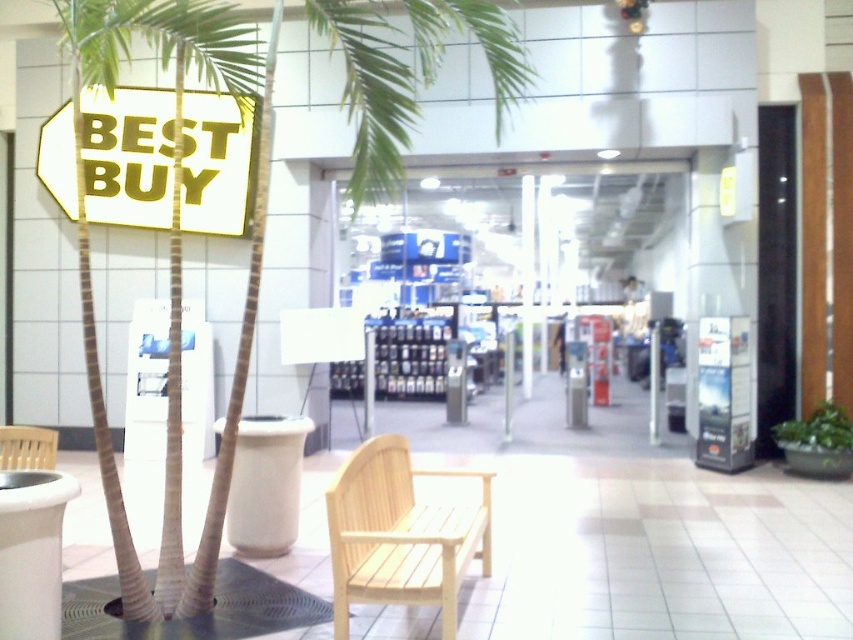
Question: Does light wood bench at lower center appear over wooden bench at lower left?

Choices:
 (A) yes
 (B) no

Answer: (B)

Question: Can you confirm if matte plastic shelves at center is wider than metallic pole at center?

Choices:
 (A) yes
 (B) no

Answer: (A)

Question: Which is nearer to the metallic pole at center?

Choices:
 (A) wooden bench at lower left
 (B) white matte sign at upper left
 (C) light wood bench at lower center

Answer: (B)

Question: Which point is farther to the camera?

Choices:
 (A) light wood bench at lower center
 (B) metallic pole at center
 (C) wooden bench at lower left
 (D) white matte sign at upper left

Answer: (B)

Question: Which point appears closest to the camera in this image?

Choices:
 (A) (380, 456)
 (B) (50, 452)

Answer: (A)

Question: Is matte plastic shelves at center below light wood bench at lower center?

Choices:
 (A) yes
 (B) no

Answer: (B)